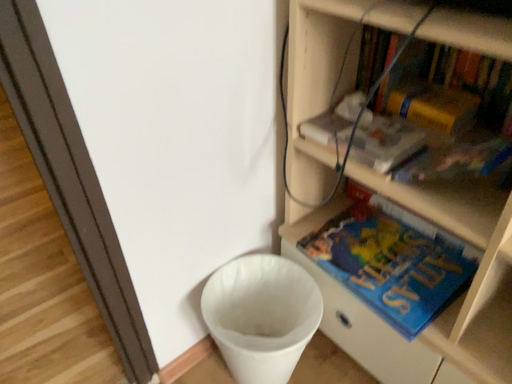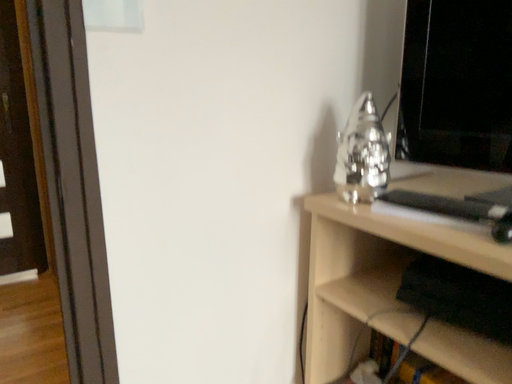
Question: How did the camera likely rotate when shooting the video?

Choices:
 (A) rotated downward
 (B) rotated upward

Answer: (B)